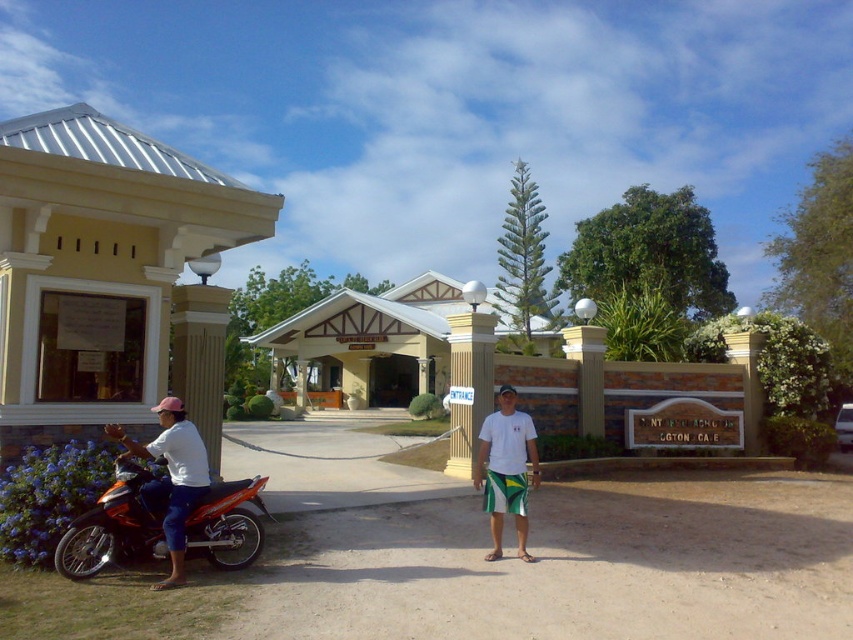
You are a visitor arriving at the resort entrance. You see the yellow matte building at center and the white cotton shirt at left. Which object is closer to you?

The white cotton shirt at left is closer to you because the yellow matte building at center is positioned over it, indicating it is further away.

You are standing at the center of the image and want to go to the beige concrete kiosk at left. Which direction should you move in?

Since the beige concrete kiosk at left is located at point (97, 266), you should move to the left to reach it.

You are a photographer trying to capture both the yellow matte building at center and the white cotton shirt at left in a single shot. Based on their sizes in the image, which object would appear larger in your photo?

The yellow matte building at center would appear larger in the photo since it is much taller than the white cotton shirt at left.